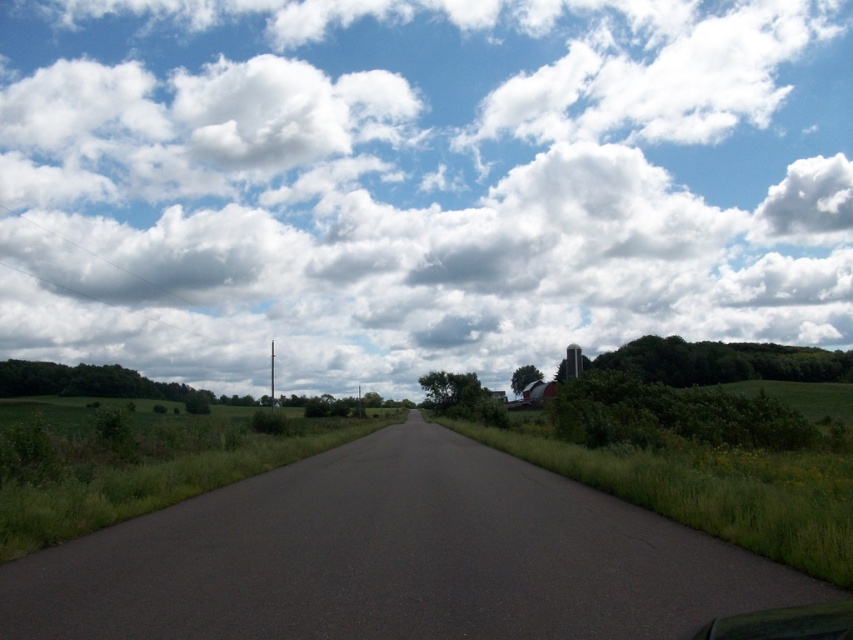
Can you confirm if dark asphalt road at center is thinner than green grass at left?

Yes, dark asphalt road at center is thinner than green grass at left.

Does point (241, 556) come closer to viewer compared to point (120, 451)?

Yes, it is in front of point (120, 451).

Does point (648, 525) come farther from viewer compared to point (19, 496)?

No.

In order to click on dark asphalt road at center in this screenshot , I will do `click(393, 557)`.

Who is more distant from viewer, (134, 152) or (672, 592)?

Positioned behind is point (134, 152).

Image resolution: width=853 pixels, height=640 pixels. Identify the location of white fluffy cloud at upper center. (418, 182).

Can you confirm if green grass at left is taller than green matte car at lower right?

Yes, green grass at left is taller than green matte car at lower right.

Between green grass at left and green matte car at lower right, which one appears on the left side from the viewer's perspective?

From the viewer's perspective, green grass at left appears more on the left side.

Locate an element on the screen. green grass at left is located at coordinates (137, 464).